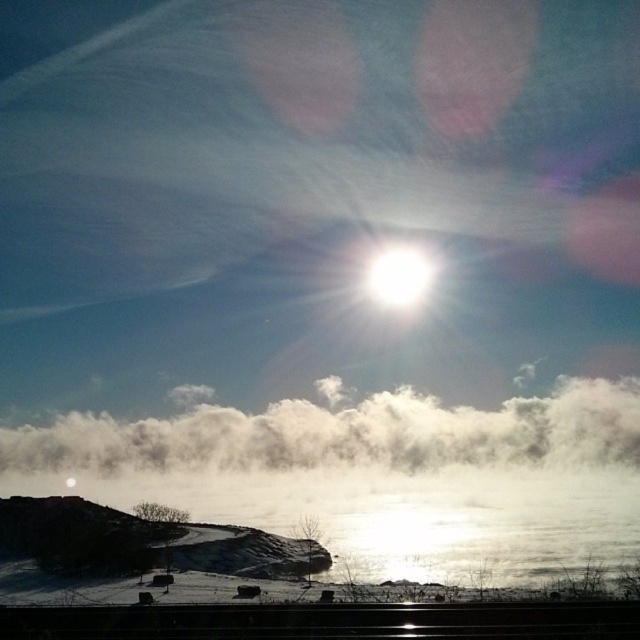
You are an astronomer observing the winter landscape. You notice the white fluffy cloud at center and the white glossy sun at upper center. Which object is higher in the sky?

The white fluffy cloud at center is taller than the white glossy sun at upper center, so the white fluffy cloud at center is higher in the sky.

You are standing at the point where the sun is located in the image. If you look towards the point labeled as point (x=342, y=435), what object would you see in that direction?

The white fluffy cloud at center is represented by point (x=342, y=435), so looking towards that point from the sun would show the white fluffy cloud at center.

You are an astronomer observing the sky and you see the white fluffy cloud at center and the white glossy sun at upper center. Which object is positioned higher in the sky?

The white glossy sun at upper center is positioned higher in the sky than the white fluffy cloud at center.